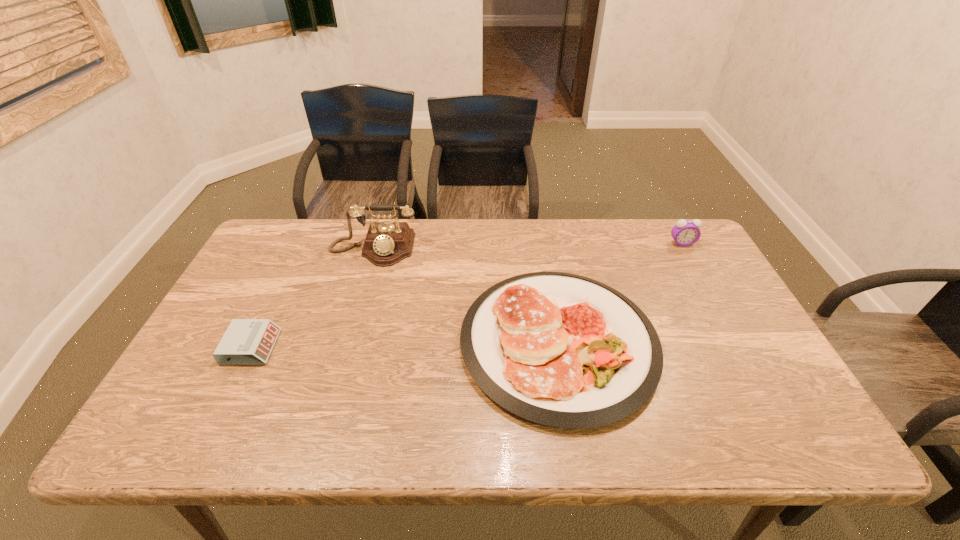
Where is `the tallest object`? the tallest object is located at coordinates (387, 243).

Find the location of `the third object from right to left`. the third object from right to left is located at coordinates (387, 243).

The height and width of the screenshot is (540, 960). Identify the location of the taller alarm clock. (686, 232).

This screenshot has width=960, height=540. In order to click on the rightmost object in this screenshot , I will do `click(686, 232)`.

Image resolution: width=960 pixels, height=540 pixels. I want to click on the second shortest object, so tap(558, 349).

Locate an element on the screen. This screenshot has width=960, height=540. the third object from left to right is located at coordinates point(558,349).

The width and height of the screenshot is (960, 540). I want to click on the shortest object, so click(x=246, y=341).

Where is `the shorter alarm clock`? the shorter alarm clock is located at coordinates (246, 341).

The height and width of the screenshot is (540, 960). Find the location of `vacant space positioned on the dial of the tallest object`. vacant space positioned on the dial of the tallest object is located at coordinates (363, 285).

Image resolution: width=960 pixels, height=540 pixels. I want to click on free space located on the face of the rightmost object, so click(718, 309).